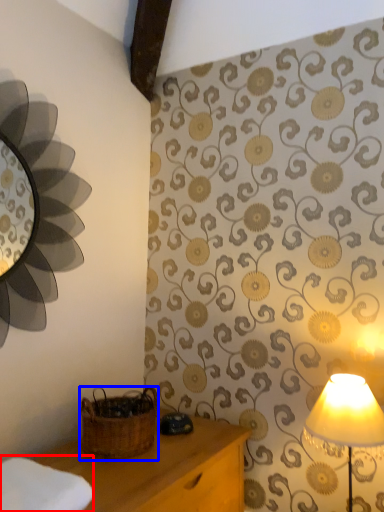
Question: Which point is further to the camera, cloth (highlighted by a red box) or basket (highlighted by a blue box)?

Choices:
 (A) cloth
 (B) basket

Answer: (B)